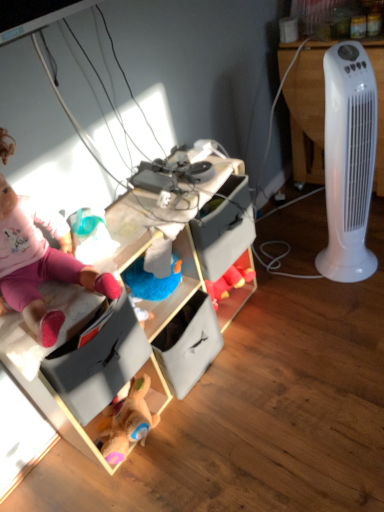
This screenshot has width=384, height=512. What are the coordinates of `white plastic tower fan at right` in the screenshot? It's located at (307, 112).

Locate an element on the screen. The width and height of the screenshot is (384, 512). white plastic tower fan at right is located at coordinates (348, 161).

What do you see at coordinates (182, 234) in the screenshot?
I see `wooden toy storage at center` at bounding box center [182, 234].

What do you see at coordinates (40, 262) in the screenshot? I see `pink fabric doll at upper left` at bounding box center [40, 262].

Locate an element on the screen. white plastic tower fan at right is located at coordinates 307,112.

From a real-world perspective, between white plastic tower fan at right and pink fabric doll at upper left, who is vertically higher?

pink fabric doll at upper left.

From the image's perspective, which is above, white plastic tower fan at right or pink fabric doll at upper left?

white plastic tower fan at right.

Is pink fabric doll at upper left completely or partially inside white plastic tower fan at right?

No, pink fabric doll at upper left is not surrounded by white plastic tower fan at right.

Does white plastic tower fan at right appear on the left side of wooden toy storage at center?

No, white plastic tower fan at right is not to the left of wooden toy storage at center.

Considering the points (295, 157) and (51, 404), which point is in front, point (295, 157) or point (51, 404)?

Point (51, 404)

Is white plastic tower fan at right next to wooden toy storage at center?

white plastic tower fan at right and wooden toy storage at center are not in contact.

Is white plastic tower fan at right completely or partially outside of wooden toy storage at center?

That's correct, white plastic tower fan at right is outside of wooden toy storage at center.

The image size is (384, 512). What are the coordinates of `cabinetry in front of the white plastic tower fan at right` in the screenshot? It's located at (182, 234).

Is white plastic tower fan at right inside wooden toy storage at center?

Definitely not — white plastic tower fan at right is not inside wooden toy storage at center.

From the image's perspective, is wooden toy storage at center under white plastic tower fan at right?

Yes, from the image's perspective, wooden toy storage at center is beneath white plastic tower fan at right.

Considering the relative sizes of wooden toy storage at center and white plastic tower fan at right in the image provided, is wooden toy storage at center taller than white plastic tower fan at right?

In fact, wooden toy storage at center may be shorter than white plastic tower fan at right.

Consider the image. Considering the positions of objects white plastic tower fan at right and pink fabric doll at upper left in the image provided, who is more to the left, white plastic tower fan at right or pink fabric doll at upper left?

Positioned to the left is pink fabric doll at upper left.

Is white plastic tower fan at right turned away from pink fabric doll at upper left?

No, pink fabric doll at upper left is not at the back of white plastic tower fan at right.

Looking at the image, does white plastic tower fan at right seem bigger or smaller compared to pink fabric doll at upper left?

Clearly, white plastic tower fan at right is smaller in size than pink fabric doll at upper left.

Measure the distance between white plastic tower fan at right and white plastic tower fan at right.

A distance of 11.65 inches exists between white plastic tower fan at right and white plastic tower fan at right.

Which object is thinner, white plastic tower fan at right or white plastic tower fan at right?

Thinner between the two is white plastic tower fan at right.

Is white plastic tower fan at right positioned far away from white plastic tower fan at right?

Actually, white plastic tower fan at right and white plastic tower fan at right are a little close together.

Could you tell me if white plastic tower fan at right is facing white plastic tower fan at right?

Yes, white plastic tower fan at right is facing white plastic tower fan at right.

From a real-world perspective, is pink fabric doll at upper left below wooden toy storage at center?

No, from a real-world perspective, pink fabric doll at upper left is not below wooden toy storage at center.

From the image's perspective, which one is positioned higher, pink fabric doll at upper left or wooden toy storage at center?

pink fabric doll at upper left.

Considering the positions of objects pink fabric doll at upper left and wooden toy storage at center in the image provided, who is in front, pink fabric doll at upper left or wooden toy storage at center?

pink fabric doll at upper left.

Is pink fabric doll at upper left completely or partially outside of wooden toy storage at center?

Yes, pink fabric doll at upper left is located beyond the bounds of wooden toy storage at center.

Based on the photo, does white plastic tower fan at right have a greater height compared to wooden toy storage at center?

Indeed, white plastic tower fan at right has a greater height compared to wooden toy storage at center.

Based on the photo, is wooden toy storage at center a part of white plastic tower fan at right?

No, wooden toy storage at center is not inside white plastic tower fan at right.

Between white plastic tower fan at right and wooden toy storage at center, which one appears on the left side from the viewer's perspective?

wooden toy storage at center is more to the left.

How much distance is there between white plastic tower fan at right and wooden toy storage at center?

white plastic tower fan at right is 23.82 inches away from wooden toy storage at center.

Image resolution: width=384 pixels, height=512 pixels. I want to click on desk lying on the right of pink fabric doll at upper left, so click(x=307, y=112).

What are the coordinates of `cabinetry that is on the left side of white plastic tower fan at right` in the screenshot? It's located at (182, 234).

Based on their spatial positions, is white plastic tower fan at right or white plastic tower fan at right further from wooden toy storage at center?

white plastic tower fan at right.

From the image, which object appears to be nearer to wooden toy storage at center, pink fabric doll at upper left or white plastic tower fan at right?

Among the two, pink fabric doll at upper left is located nearer to wooden toy storage at center.

Based on their spatial positions, is white plastic tower fan at right or pink fabric doll at upper left closer to white plastic tower fan at right?

white plastic tower fan at right is positioned closer to the anchor white plastic tower fan at right.

Consider the image. Considering their positions, is white plastic tower fan at right positioned closer to wooden toy storage at center than white plastic tower fan at right?

Based on the image, white plastic tower fan at right appears to be nearer to wooden toy storage at center.

From the image, which object appears to be farther from wooden toy storage at center, white plastic tower fan at right or pink fabric doll at upper left?

white plastic tower fan at right lies further to wooden toy storage at center than the other object.

Based on their spatial positions, is white plastic tower fan at right or pink fabric doll at upper left further from white plastic tower fan at right?

pink fabric doll at upper left.

Which object lies nearer to the anchor point white plastic tower fan at right, wooden toy storage at center or white plastic tower fan at right?

white plastic tower fan at right.

Which object lies nearer to the anchor point wooden toy storage at center, pink fabric doll at upper left or white plastic tower fan at right?

The object closer to wooden toy storage at center is pink fabric doll at upper left.

The width and height of the screenshot is (384, 512). Find the location of `cabinetry between pink fabric doll at upper left and white plastic tower fan at right`. cabinetry between pink fabric doll at upper left and white plastic tower fan at right is located at coordinates (182, 234).

The height and width of the screenshot is (512, 384). I want to click on home appliance between wooden toy storage at center and white plastic tower fan at right, so tap(348, 161).

Locate an element on the screen. home appliance between pink fabric doll at upper left and white plastic tower fan at right from left to right is located at coordinates (348, 161).

At what (x,y) coordinates should I click in order to perform the action: click on cabinetry situated between pink fabric doll at upper left and white plastic tower fan at right from left to right. Please return your answer as a coordinate pair (x, y). The width and height of the screenshot is (384, 512). Looking at the image, I should click on (182, 234).